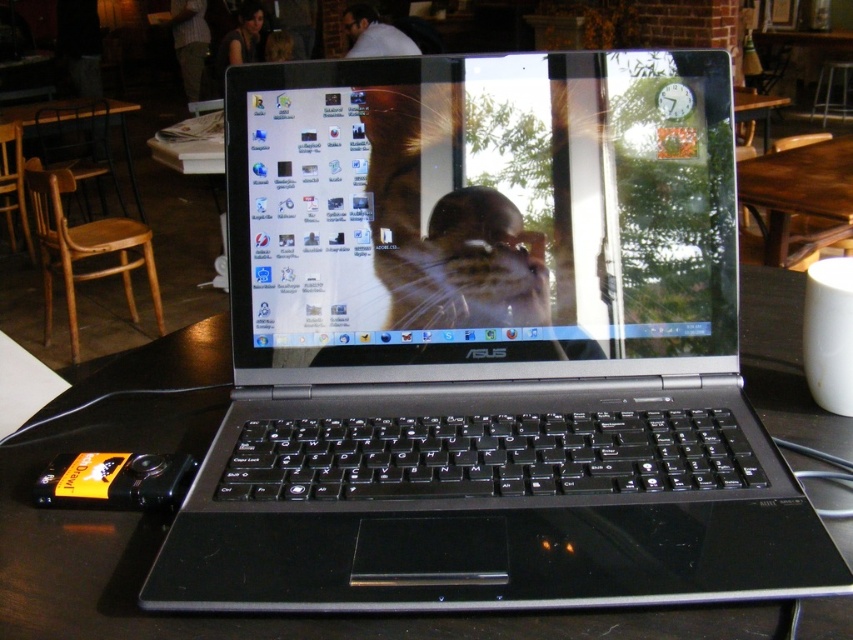
Question: Can you confirm if black plastic laptop at center is positioned below brown wooden table at center?

Choices:
 (A) no
 (B) yes

Answer: (B)

Question: Which of these objects is positioned farthest from the satin black laptop at center?

Choices:
 (A) shiny fur cat at center
 (B) brown wooden table at center
 (C) black plastic laptop at center

Answer: (B)

Question: Which of the following is the closest to the observer?

Choices:
 (A) satin black laptop at center
 (B) shiny fur cat at center

Answer: (A)

Question: Which object appears farthest from the camera in this image?

Choices:
 (A) shiny fur cat at center
 (B) brown wooden table at center

Answer: (B)

Question: Does satin black laptop at center appear on the right side of shiny fur cat at center?

Choices:
 (A) yes
 (B) no

Answer: (A)

Question: Does black plastic laptop at center appear under satin black laptop at center?

Choices:
 (A) yes
 (B) no

Answer: (A)